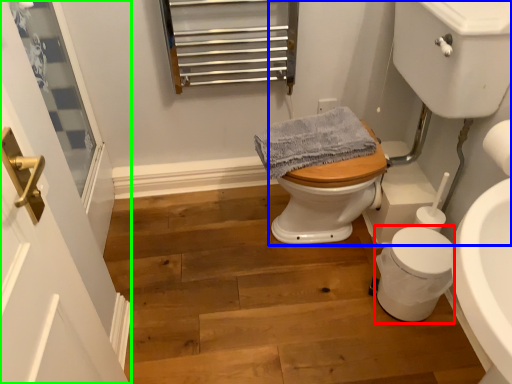
Question: Estimate the real-world distances between objects in this image. Which object is closer to porcelain (highlighted by a red box), sink (highlighted by a blue box) or screen door (highlighted by a green box)?

Choices:
 (A) sink
 (B) screen door

Answer: (A)